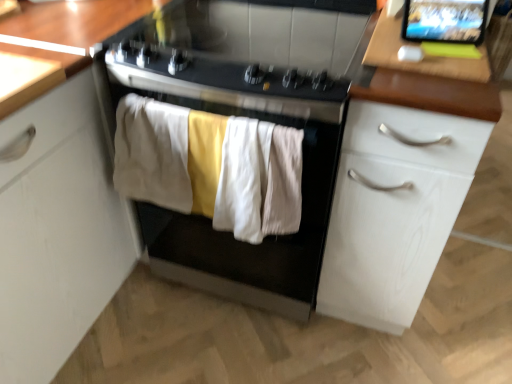
Question: Is wooden table at upper right taller or shorter than soft cotton towels at center, which is the second clothing in right-to-left order?

Choices:
 (A) tall
 (B) short

Answer: (B)

Question: Visually, is wooden table at upper right positioned to the left or to the right of soft cotton towels at center, which is the second clothing in right-to-left order?

Choices:
 (A) left
 (B) right

Answer: (B)

Question: Based on their relative distances, which object is nearer to the white wood cabinet at right?

Choices:
 (A) soft cotton towels at center, the 2th clothing from the left
 (B) beige cotton towel at center, the third clothing viewed from the right
 (C) wooden table at upper right
 (D) white cotton towel at center, the first clothing in the right-to-left sequence
 (E) matte black tablet at upper right

Answer: (D)

Question: Which is farther from the white wood cabinet at right?

Choices:
 (A) black matte oven at center
 (B) beige cotton towel at center, the third clothing viewed from the right
 (C) wooden table at upper right
 (D) soft cotton towels at center, the 2th clothing from the left
 (E) black glass gas stove at center

Answer: (B)